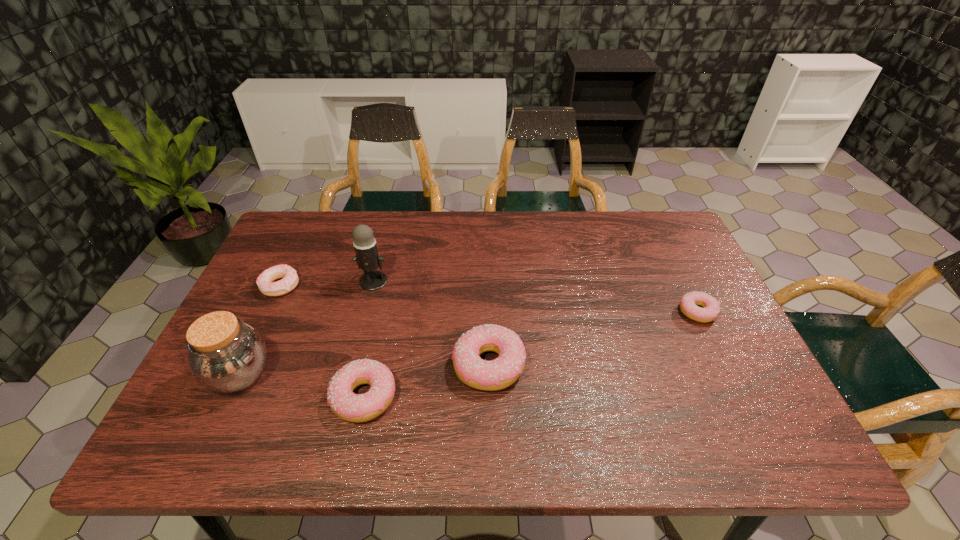
Where is `the fourth tallest object`? This screenshot has height=540, width=960. the fourth tallest object is located at coordinates (351, 407).

At what (x,y) coordinates should I click in order to perform the action: click on the second tallest doughnut. Please return your answer as a coordinate pair (x, y). Image resolution: width=960 pixels, height=540 pixels. Looking at the image, I should click on (351, 407).

What are the coordinates of `the third doughnut from left to right` in the screenshot? It's located at (497, 374).

The image size is (960, 540). In order to click on the rightmost object in this screenshot , I will do point(711,309).

Where is `the leftmost doughnut`? This screenshot has width=960, height=540. the leftmost doughnut is located at coordinates (265, 283).

I want to click on the tallest object, so click(367, 258).

You are a GUI agent. You are given a task and a screenshot of the screen. Output one action in this format:
    pyautogui.click(x=<x>, y=<y>)
    Task: Click on the jar
    
    Given the screenshot: What is the action you would take?
    pyautogui.click(x=226, y=355)

The height and width of the screenshot is (540, 960). What are the coordinates of `vacant space located 0.120m on the right of the second doughnut from left to right` in the screenshot? It's located at (450, 397).

You are a GUI agent. You are given a task and a screenshot of the screen. Output one action in this format:
    pyautogui.click(x=<x>, y=<y>)
    Task: Click on the vacant space located 0.380m on the back of the third doughnut from left to right
    This screenshot has height=540, width=960.
    Given the screenshot: What is the action you would take?
    487,244

What are the coordinates of `vacant position located 0.250m on the back of the rightmost doughnut` in the screenshot? It's located at (663, 242).